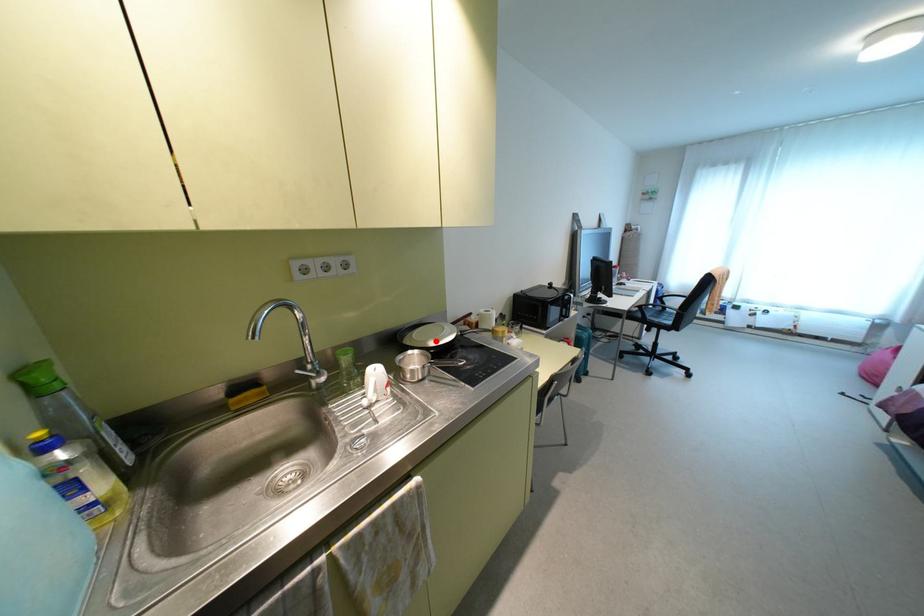
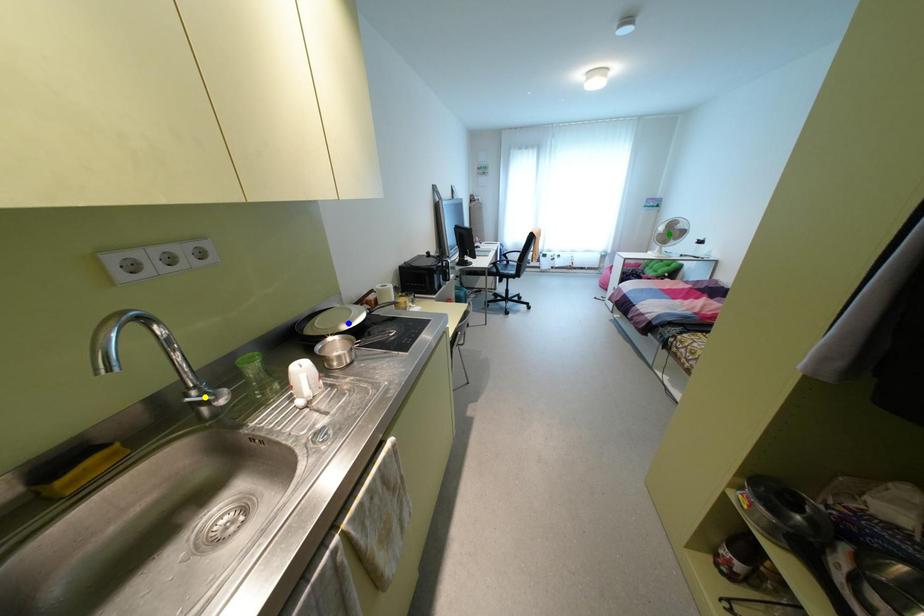
Question: I am providing you with two images of the same scene from different viewpoints. A red point is marked on the first image. You are given multiple points on the second image. Can you choose the point in image 2 that corresponds to the point in image 1?

Choices:
 (A) blue point
 (B) yellow point
 (C) green point

Answer: (A)